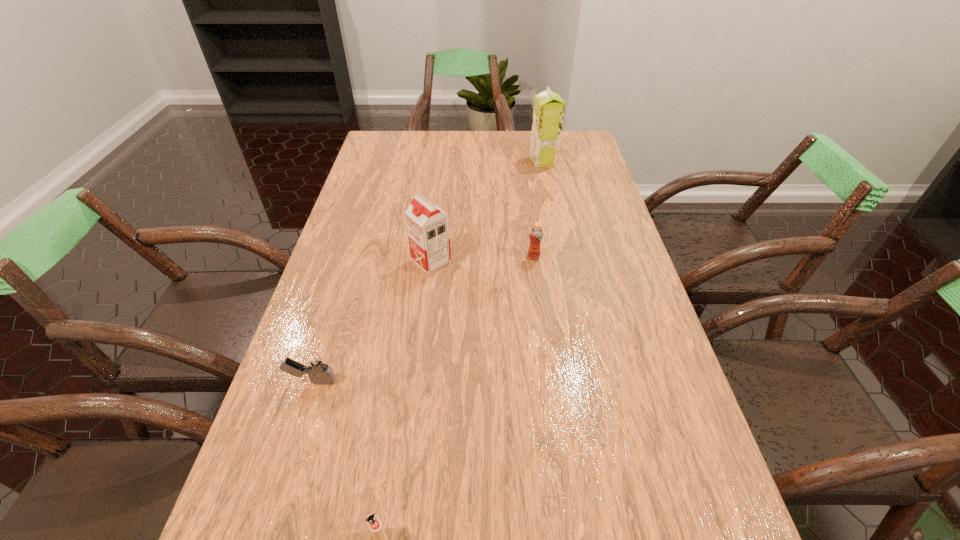
Where is `free space located on the right of the farther igniter`? free space located on the right of the farther igniter is located at coordinates (470, 381).

You are a GUI agent. You are given a task and a screenshot of the screen. Output one action in this format:
    pyautogui.click(x=<x>, y=<y>)
    Task: Click on the object present at the far edge
    This screenshot has width=960, height=540.
    Given the screenshot: What is the action you would take?
    pyautogui.click(x=548, y=113)

At what (x,y) coordinates should I click in order to perform the action: click on object that is at the left edge. Please return your answer as a coordinate pair (x, y). Looking at the image, I should click on (315, 365).

The width and height of the screenshot is (960, 540). In order to click on object present at the right edge in this screenshot , I will do `click(548, 113)`.

The width and height of the screenshot is (960, 540). Find the location of `object present at the far right corner`. object present at the far right corner is located at coordinates (548, 113).

At what (x,y) coordinates should I click in order to perform the action: click on vacant region at the far edge of the desktop. Please return your answer as a coordinate pair (x, y). Looking at the image, I should click on (445, 148).

Where is `vacant space at the left edge of the desktop`? vacant space at the left edge of the desktop is located at coordinates (286, 377).

Where is `vacant area at the right edge of the desktop`? The image size is (960, 540). vacant area at the right edge of the desktop is located at coordinates (579, 249).

This screenshot has height=540, width=960. Find the location of `blank space at the far left corner of the desktop`. blank space at the far left corner of the desktop is located at coordinates (402, 143).

You are a GUI agent. You are given a task and a screenshot of the screen. Output one action in this format:
    pyautogui.click(x=<x>, y=<y>)
    Task: Click on the free space between the leftmost object and the fourth object from left to right
    Image resolution: width=960 pixels, height=540 pixels.
    Given the screenshot: What is the action you would take?
    pyautogui.click(x=423, y=319)